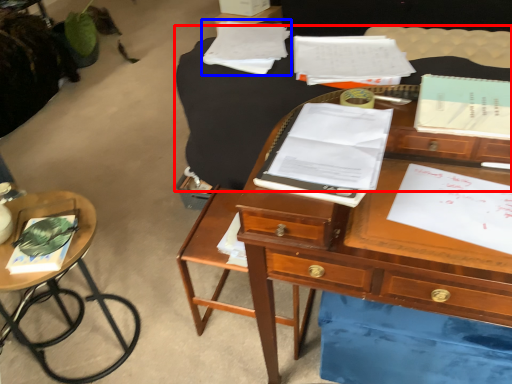
Question: Which object appears closest to the camera in this image, table (highlighted by a red box) or notebook (highlighted by a blue box)?

Choices:
 (A) table
 (B) notebook

Answer: (A)